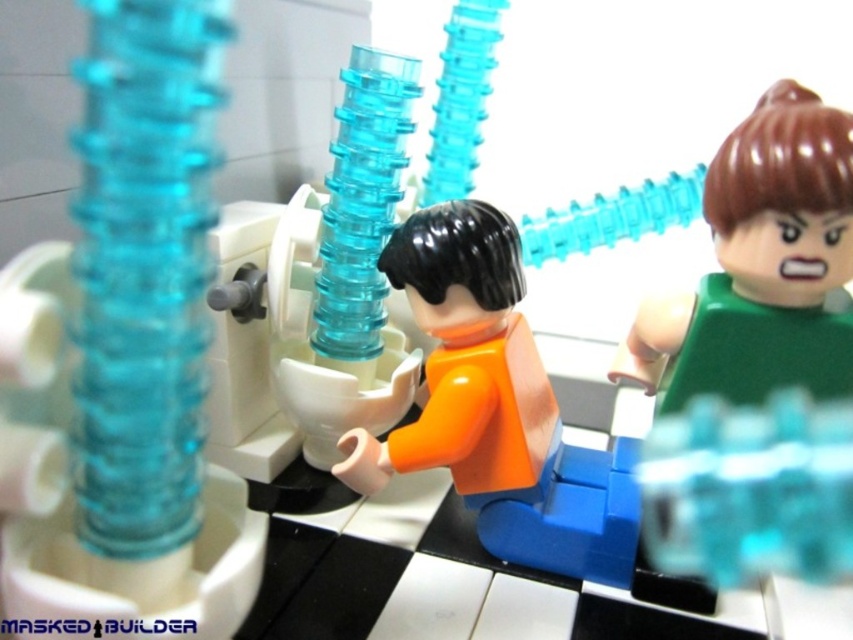
Is transparent blue tube at center behind orange matte figure at center?

That is False.

Does point (170, 136) come behind point (543, 426)?

No, it is in front of (543, 426).

Is point (146, 61) positioned in front of point (389, 472)?

That is True.

This screenshot has height=640, width=853. Find the location of `transparent blue tube at center`. transparent blue tube at center is located at coordinates (132, 352).